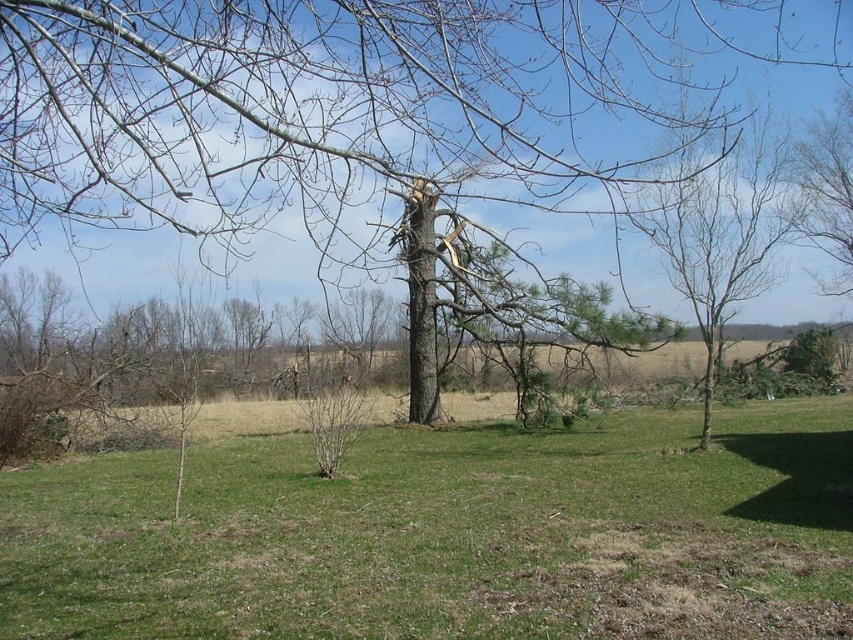
Does green grass at center have a smaller size compared to brown rough tree at center?

Correct, green grass at center occupies less space than brown rough tree at center.

Find the location of a particular element. This screenshot has width=853, height=640. green grass at center is located at coordinates (450, 536).

Image resolution: width=853 pixels, height=640 pixels. Identify the location of green grass at center. click(x=450, y=536).

Is green grass at center wider than bare branches at right?

Yes.

Which is below, green grass at center or bare branches at right?

Positioned lower is green grass at center.

Where is `green grass at center`? green grass at center is located at coordinates (450, 536).

Between point (344, 260) and point (676, 262), which one is positioned in front?

Point (344, 260)

Image resolution: width=853 pixels, height=640 pixels. What do you see at coordinates (352, 106) in the screenshot? I see `brown rough tree at center` at bounding box center [352, 106].

Who is more forward, (244, 115) or (729, 148)?

Positioned in front is point (244, 115).

This screenshot has height=640, width=853. I want to click on brown rough tree at center, so click(x=352, y=106).